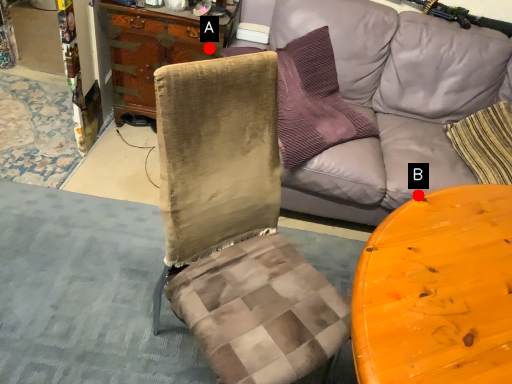
Question: Two points are circled on the image, labeled by A and B beside each circle. Which of the following is the closest to the observer?

Choices:
 (A) A is closer
 (B) B is closer

Answer: (B)